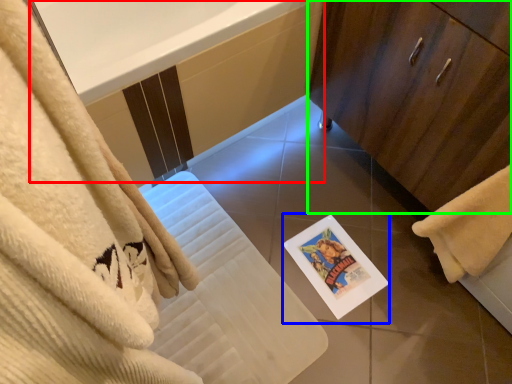
Question: Estimate the real-world distances between objects in this image. Which object is closer to bath (highlighted by a red box), postcard (highlighted by a blue box) or bathroom cabinet (highlighted by a green box)?

Choices:
 (A) postcard
 (B) bathroom cabinet

Answer: (B)